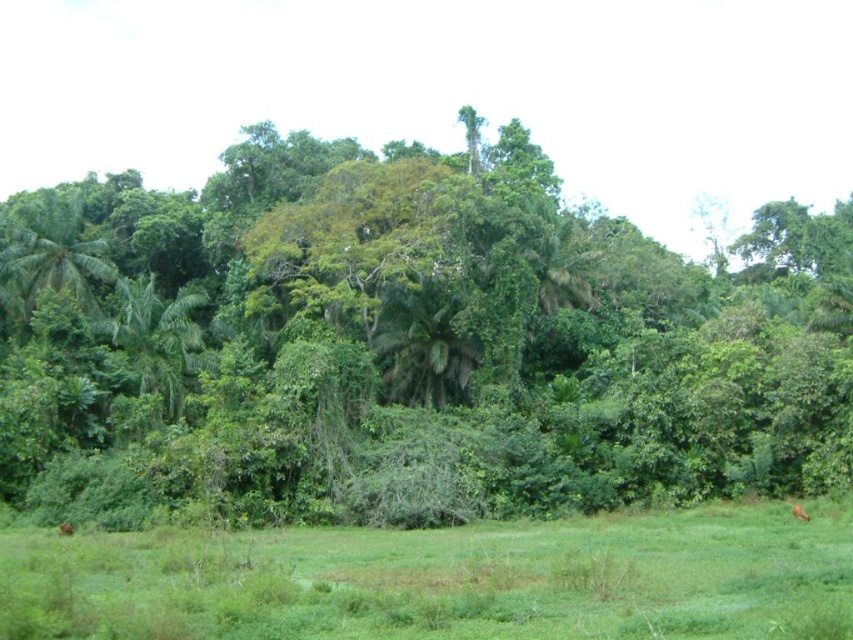
Is green leafy tree at center closer to the viewer compared to green grassy field at lower center?

No, green leafy tree at center is further to the viewer.

This screenshot has height=640, width=853. Describe the element at coordinates (408, 339) in the screenshot. I see `green leafy tree at center` at that location.

This screenshot has width=853, height=640. Identify the location of green leafy tree at center. (408, 339).